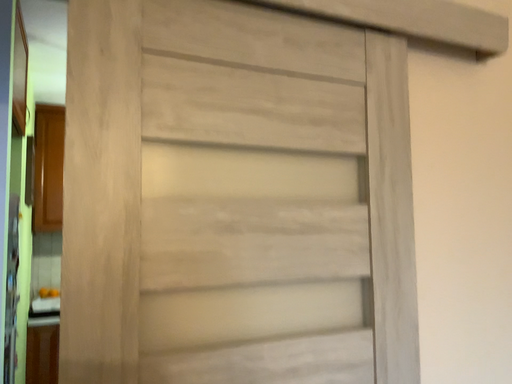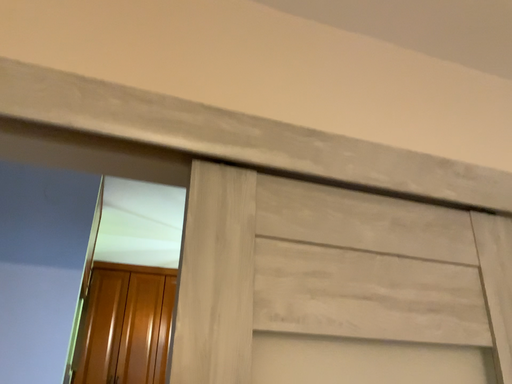
Question: How did the camera likely rotate when shooting the video?

Choices:
 (A) rotated upward
 (B) rotated downward

Answer: (A)